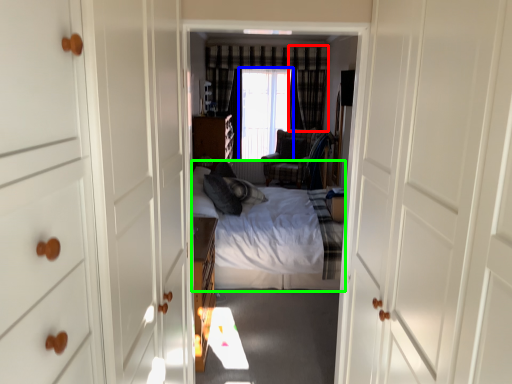
Question: Which is farther away from curtain (highlighted by a red box)? window screen (highlighted by a blue box) or bed (highlighted by a green box)?

Choices:
 (A) window screen
 (B) bed

Answer: (B)